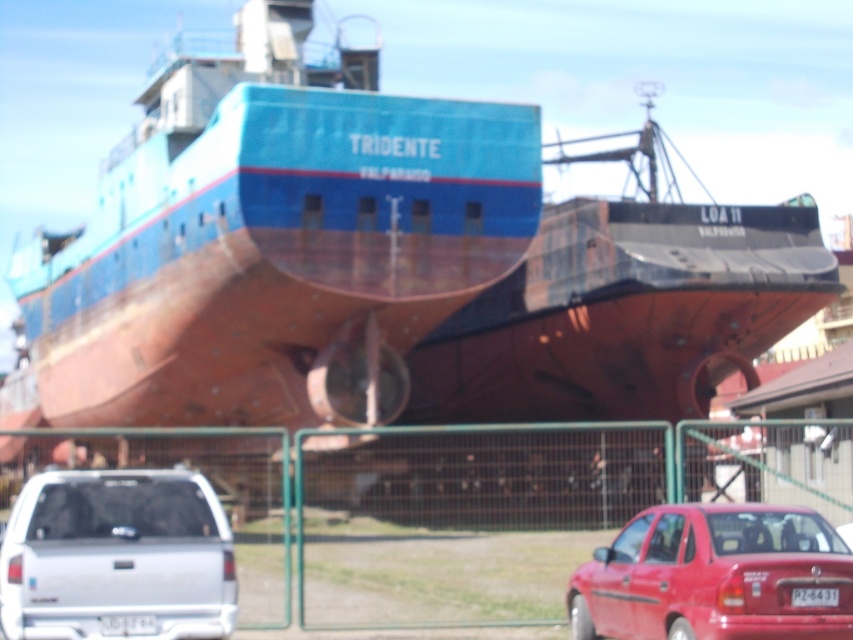
Question: Which object appears closest to the camera in this image?

Choices:
 (A) silver metallic pickup truck at lower left
 (B) white plastic license plate at center
 (C) shiny red sedan at lower right

Answer: (C)

Question: Estimate the real-world distances between objects in this image. Which object is closer to the shiny red sedan at lower right?

Choices:
 (A) white plastic license plate at lower center
 (B) white plastic license plate at center

Answer: (B)

Question: Is silver metallic pickup truck at lower left further to camera compared to white plastic license plate at lower center?

Choices:
 (A) no
 (B) yes

Answer: (A)

Question: Does shiny red sedan at lower right have a greater width compared to white plastic license plate at center?

Choices:
 (A) no
 (B) yes

Answer: (B)

Question: Is the position of silver metallic pickup truck at lower left less distant than that of white plastic license plate at center?

Choices:
 (A) no
 (B) yes

Answer: (A)

Question: Which object is positioned closest to the silver metallic pickup truck at lower left?

Choices:
 (A) white plastic license plate at lower center
 (B) white plastic license plate at center
 (C) shiny red sedan at lower right

Answer: (A)